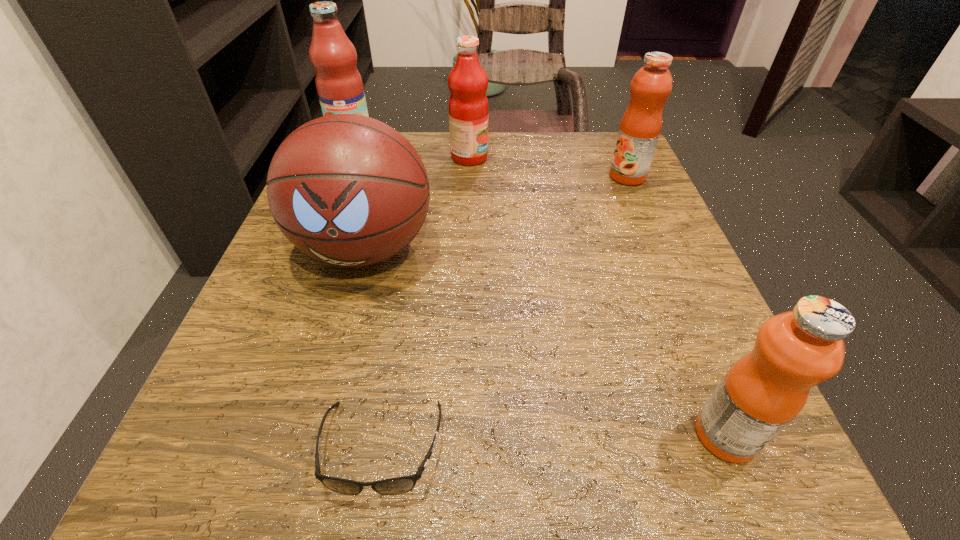
In the image, there is a desktop. At what (x,y) coordinates should I click in order to perform the action: click on vacant area at the near left corner. Please return your answer as a coordinate pair (x, y). This screenshot has height=540, width=960. Looking at the image, I should click on (258, 502).

At what (x,y) coordinates should I click in order to perform the action: click on vacant region at the far right corner of the desktop. Please return your answer as a coordinate pair (x, y). This screenshot has width=960, height=540. Looking at the image, I should click on (566, 134).

I want to click on free region at the near right corner of the desktop, so (697, 496).

Where is `vacant point located between the sunglasses and the nearest fruit juice`? vacant point located between the sunglasses and the nearest fruit juice is located at coordinates (554, 442).

In order to click on vacant point located between the nearest fruit juice and the leftmost fruit juice in this screenshot , I will do `click(540, 289)`.

Where is `free space that is in between the sunglasses and the leftmost fruit juice`? This screenshot has width=960, height=540. free space that is in between the sunglasses and the leftmost fruit juice is located at coordinates (367, 296).

Where is `empty location between the shortest object and the nearest fruit juice`? This screenshot has width=960, height=540. empty location between the shortest object and the nearest fruit juice is located at coordinates (554, 442).

Identify the location of vacant area that lies between the leftmost fruit juice and the nearest fruit juice. Image resolution: width=960 pixels, height=540 pixels. (540, 289).

You are a GUI agent. You are given a task and a screenshot of the screen. Output one action in this format:
    pyautogui.click(x=<x>, y=<y>)
    Task: Click on the object identified as the fourth closest to the nearest fruit juice
    The image size is (960, 540).
    Given the screenshot: What is the action you would take?
    pyautogui.click(x=468, y=108)

Identify which object is the second closest to the second fruit juice from left to right. Please provide its 2D coordinates. Your answer should be formatted as a tuple, i.e. [(x, y)], where the tuple contains the x and y coordinates of a point satisfying the conditions above.

[(339, 85)]